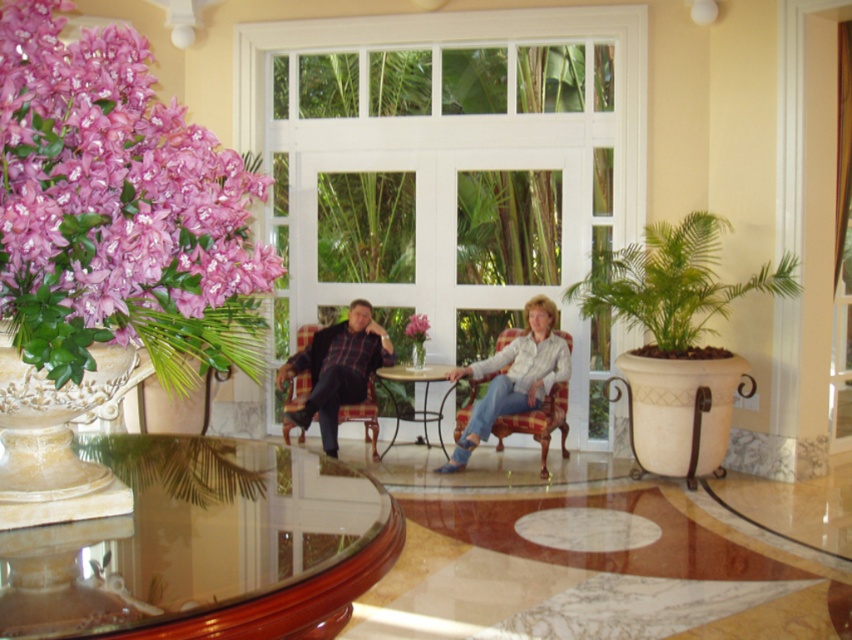
You are standing in the center of the room and want to move towards the plaid fabric armchair at center. Which direction should you move in?

The plaid fabric armchair at center is located at coordinates 0.662 on the x axis and 0.634 on the y axis, so you should move towards the direction of those coordinates to reach it.

You are standing at the entrance of the lounge and see the point marked at coordinate (204, 545). What object is located at that point?

The point at coordinate (204, 545) indicates the transparent glass table at center.

You are a guest in this lounge and want to take a photo of the pink matte flower at center without any furniture blocking the view. Is the plaid fabric armchair at center in the way?

The plaid fabric armchair at center is in front of the pink matte flower at center, so it would block the view. Move the chair or reposition yourself to avoid it.